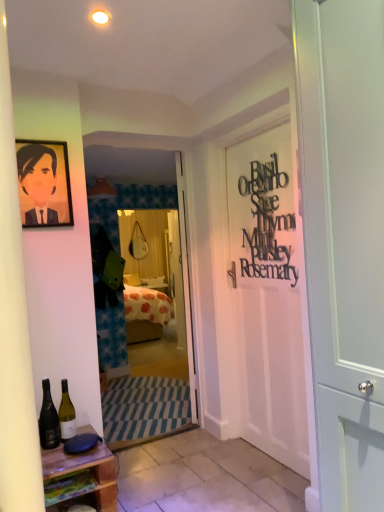
Question: Relative to white wooden door at center, which appears as the 1th door when viewed from the left, is white tile at lower center in front or behind?

Choices:
 (A) front
 (B) behind

Answer: (A)

Question: In terms of size, does white tile at lower center appear bigger or smaller than white wooden door at center, which appears as the 1th door when viewed from the left?

Choices:
 (A) small
 (B) big

Answer: (A)

Question: Which object is positioned closest to the matte black portrait at upper left?

Choices:
 (A) white matte door at center, the 1th door when ordered from front to back
 (B) green glass wine bottle at lower left, which is the 1th bottle in right-to-left order
 (C) dark green glass bottle at lower left, which is the second bottle from right to left
 (D) wooden at lower left
 (E) black metallic sign at right

Answer: (C)

Question: Which of these objects is positioned closest to the black metallic sign at right?

Choices:
 (A) white tile at lower center
 (B) green glass wine bottle at lower left, which is the 1th bottle in right-to-left order
 (C) white wooden door at center, which appears as the 1th door when viewed from the left
 (D) clear plastic screen door at center
 (E) wooden at lower left

Answer: (C)